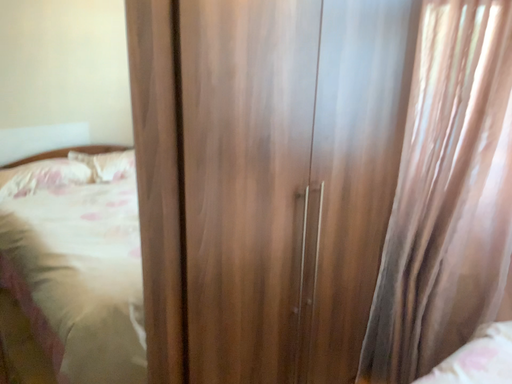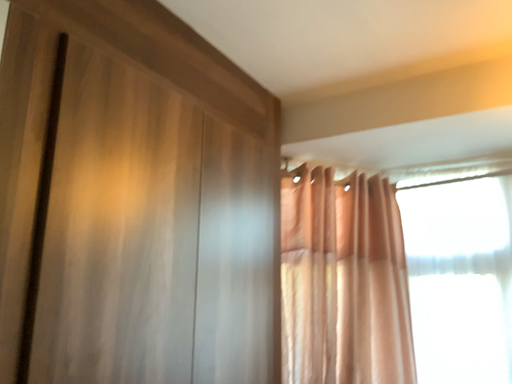
Question: How did the camera likely rotate when shooting the video?

Choices:
 (A) rotated right
 (B) rotated left

Answer: (A)